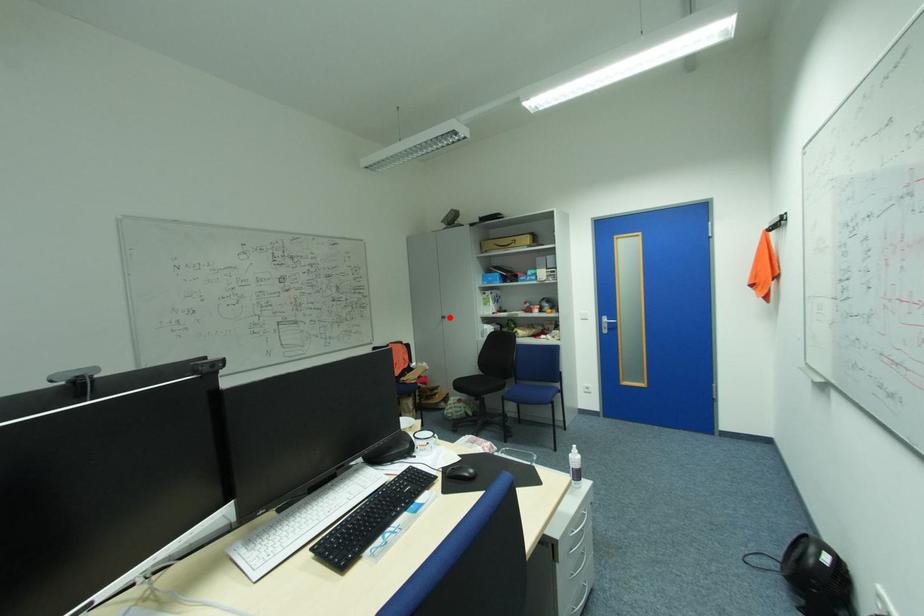
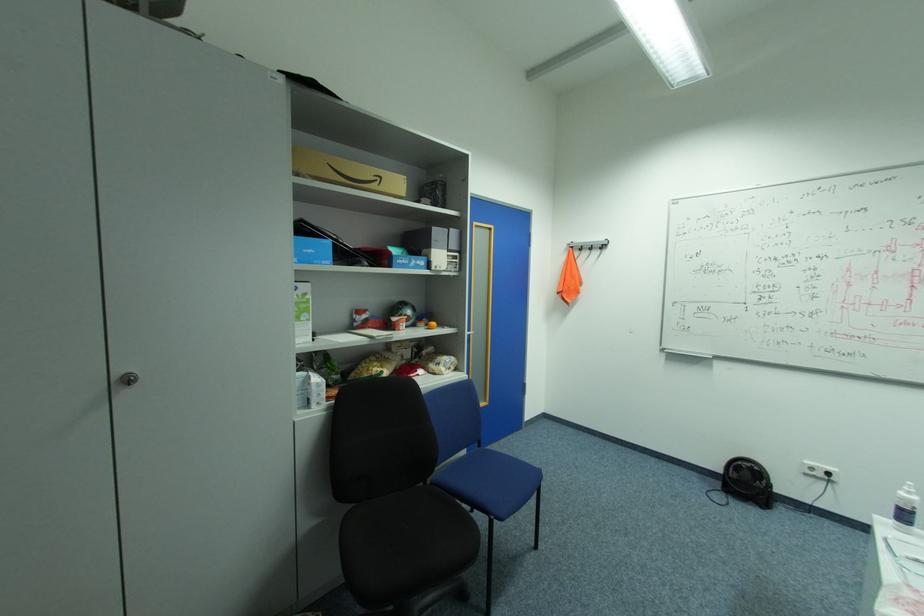
The point at the highlighted location is marked in the first image. Where is the corresponding point in the second image?

(137, 379)